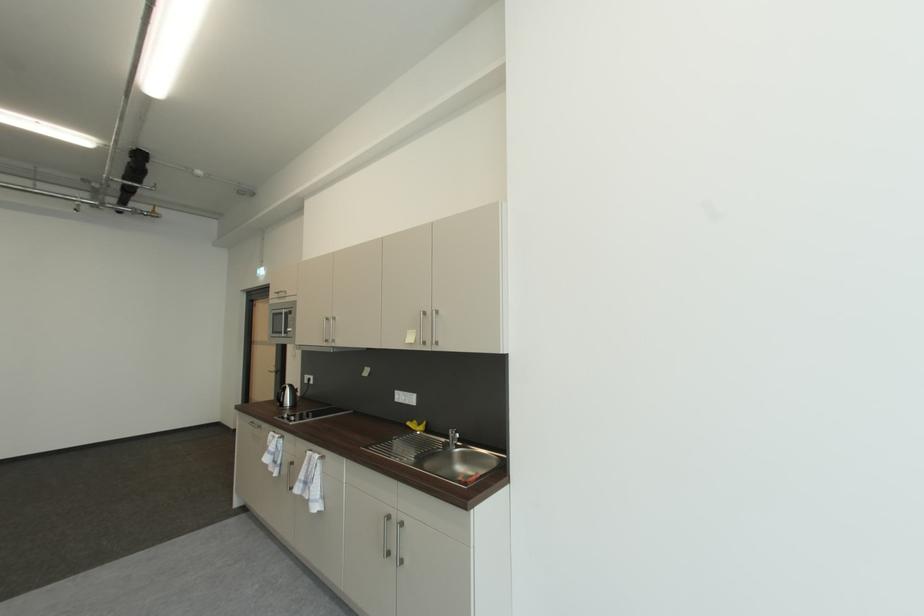
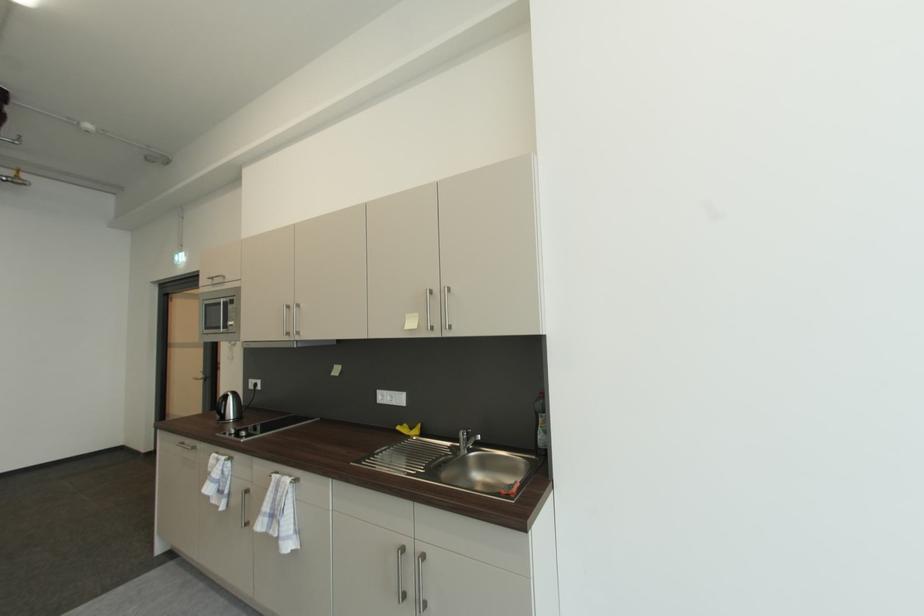
The images are taken continuously from a first-person perspective. In which direction are you moving?

The cameraman walked toward left, forward.